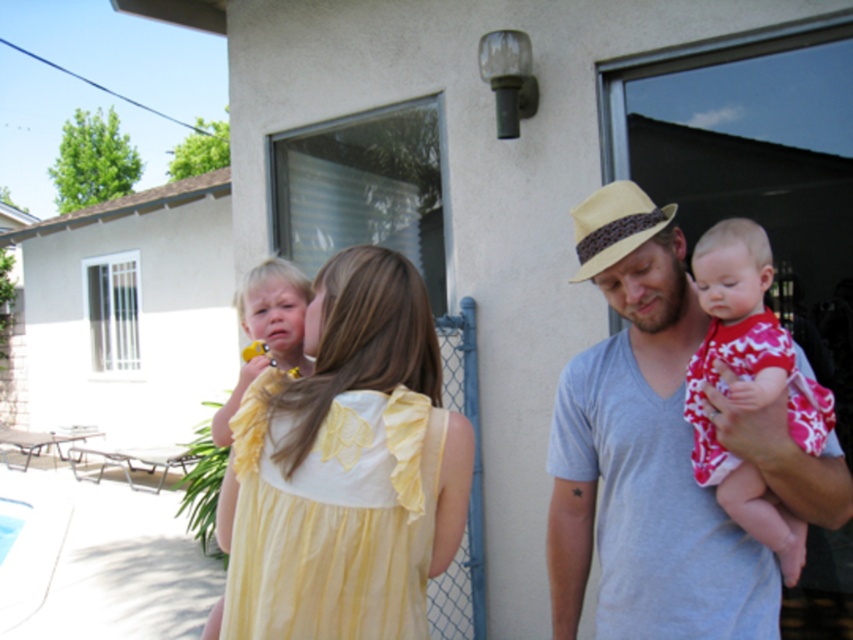
Is printed cotton dress at right thinner than yellow cotton dress at center?

No.

Measure the distance between point (732, 326) and camera.

The distance of point (732, 326) from camera is 5.85 feet.

Identify the location of printed cotton dress at right. (749, 384).

Can you confirm if yellow chiffon dress at center is positioned to the right of yellow cotton dress at center?

Indeed, yellow chiffon dress at center is positioned on the right side of yellow cotton dress at center.

Based on the photo, between yellow chiffon dress at center and yellow cotton dress at center, which one appears on the left side from the viewer's perspective?

From the viewer's perspective, yellow cotton dress at center appears more on the left side.

Is point (235, 627) less distant than point (279, 307)?

Yes.

Locate an element on the screen. The width and height of the screenshot is (853, 640). yellow chiffon dress at center is located at coordinates (334, 518).

The width and height of the screenshot is (853, 640). Find the location of `gray cotton shirt at center`. gray cotton shirt at center is located at coordinates (643, 451).

Can you confirm if gray cotton shirt at center is bigger than printed cotton dress at right?

Correct, gray cotton shirt at center is larger in size than printed cotton dress at right.

Is point (674, 545) farther from viewer compared to point (827, 401)?

That is True.

Locate an element on the screen. gray cotton shirt at center is located at coordinates (643, 451).